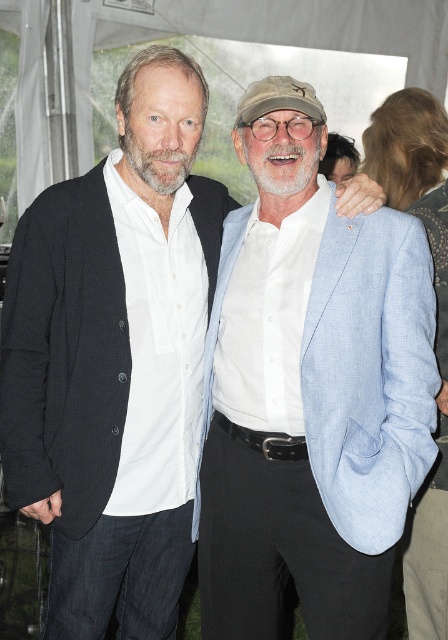
Consider the image. Is light blue linen blazer at center wider than white fabric canopy at upper center?

Incorrect, light blue linen blazer at center's width does not surpass white fabric canopy at upper center's.

Which is behind, point (344, 244) or point (20, 131)?

Positioned behind is point (20, 131).

Identify the location of light blue linen blazer at center. (310, 388).